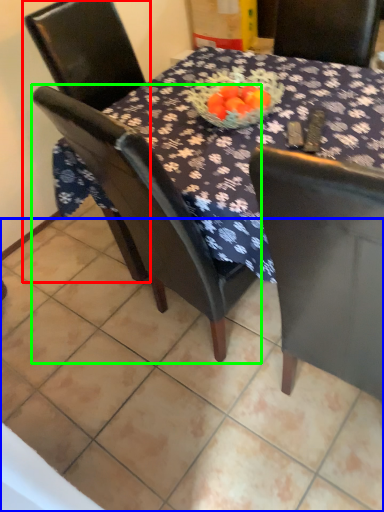
Question: Considering the real-world distances, which object is farthest from chair (highlighted by a red box)? tile (highlighted by a blue box) or chair (highlighted by a green box)?

Choices:
 (A) tile
 (B) chair

Answer: (A)